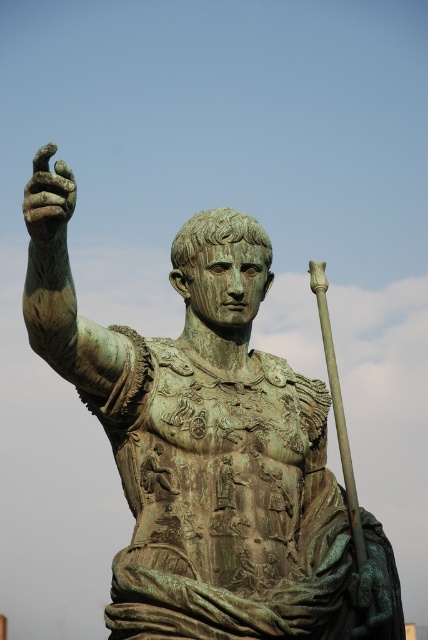
You are standing in front of the bronze statue and want to take a photo of the point at coordinate point (208, 314). If your camera has a maximum focus range of 300 feet, will it be able to focus on that point?

The distance of point (208, 314) from the camera is 288.50 feet, which is within the camera maximum focus range of 300 feet. Therefore, the camera can focus on that point.

Where is the green patina bronze statue at center located in the image?

The green patina bronze statue at center is located at point (216, 456).